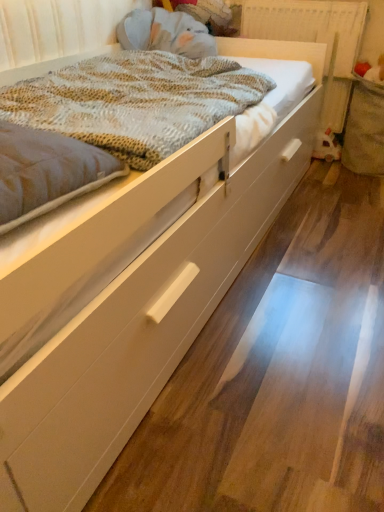
Find the location of `textured beige blanket at center`. textured beige blanket at center is located at coordinates (135, 101).

In order to face textured beige blanket at center, should I rotate leftwards or rightwards?

You should rotate left by 8.415 degrees.

Describe the element at coordinates (135, 101) in the screenshot. I see `textured beige blanket at center` at that location.

Find the location of a particular element. textured beige blanket at center is located at coordinates (135, 101).